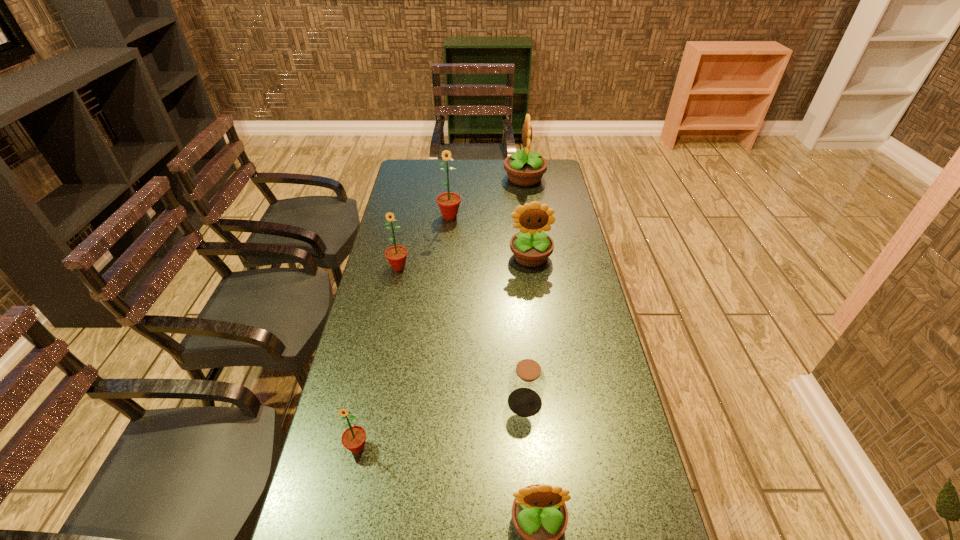
Identify which object is located as the third nearest to the brown jar. Please provide its 2D coordinates. Your answer should be formatted as a tuple, i.e. [(x, y)], where the tuple contains the x and y coordinates of a point satisfying the conditions above.

[(531, 247)]

Find the location of `sunflower that can be found as the third closest to the jar`. sunflower that can be found as the third closest to the jar is located at coordinates (531, 247).

Select which sunflower appears as the third closest to the second farthest object. Please provide its 2D coordinates. Your answer should be formatted as a tuple, i.e. [(x, y)], where the tuple contains the x and y coordinates of a point satisfying the conditions above.

[(396, 255)]

Locate an element on the screen. The width and height of the screenshot is (960, 540). yellow sunflower that is the closest to the sixth farthest object is located at coordinates (539, 514).

Locate which yellow sunflower is the closest to the second farthest object. Please provide its 2D coordinates. Your answer should be formatted as a tuple, i.e. [(x, y)], where the tuple contains the x and y coordinates of a point satisfying the conditions above.

[(531, 247)]

Locate which green sunflower is the closest to the farthest sunflower. Please provide its 2D coordinates. Your answer should be formatted as a tuple, i.e. [(x, y)], where the tuple contains the x and y coordinates of a point satisfying the conditions above.

[(449, 202)]

The width and height of the screenshot is (960, 540). I want to click on green sunflower that is the second closest to the farthest object, so click(396, 255).

Find the location of `free region that satisfies the following two spatial constraints: 1. on the face of the farthest yellow sunflower; 2. on the face of the second nearest yellow sunflower`. free region that satisfies the following two spatial constraints: 1. on the face of the farthest yellow sunflower; 2. on the face of the second nearest yellow sunflower is located at coordinates (537, 257).

The height and width of the screenshot is (540, 960). I want to click on vacant point that satisfies the following two spatial constraints: 1. on the face of the shortest object; 2. on the right side of the second farthest green sunflower, so click(x=370, y=402).

Locate an element on the screen. The width and height of the screenshot is (960, 540). vacant position in the image that satisfies the following two spatial constraints: 1. on the face of the fourth sunflower from right to left; 2. on the left side of the jar is located at coordinates (433, 402).